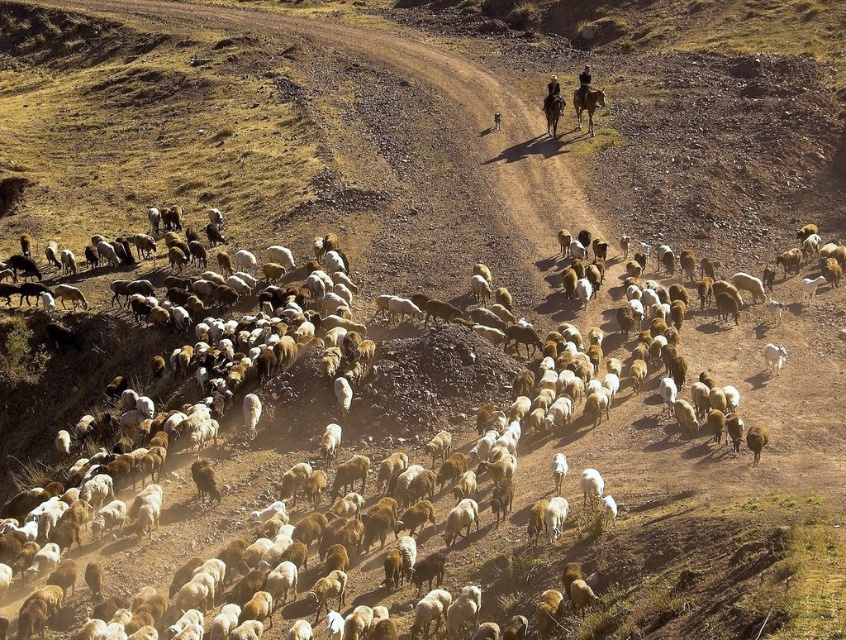
Question: Which point appears closest to the camera in this image?

Choices:
 (A) (625, 449)
 (B) (581, 81)
 (C) (594, 108)

Answer: (A)

Question: Does white woolly sheep at center have a larger size compared to brown glossy horse at upper center?

Choices:
 (A) no
 (B) yes

Answer: (B)

Question: Which point is farther from the camera taking this photo?

Choices:
 (A) (583, 72)
 (B) (819, 298)

Answer: (A)

Question: Observing the image, what is the correct spatial positioning of brown leather jacket at center in reference to dark brown leather jacket at upper center?

Choices:
 (A) left
 (B) right

Answer: (A)

Question: Is brown leather jacket at center to the left of dark brown leather jacket at upper center from the viewer's perspective?

Choices:
 (A) yes
 (B) no

Answer: (A)

Question: Which of these objects is positioned farthest from the dark brown leather jacket at upper center?

Choices:
 (A) brown leather jacket at center
 (B) white woolly sheep at center
 (C) brown glossy horse at upper center

Answer: (B)